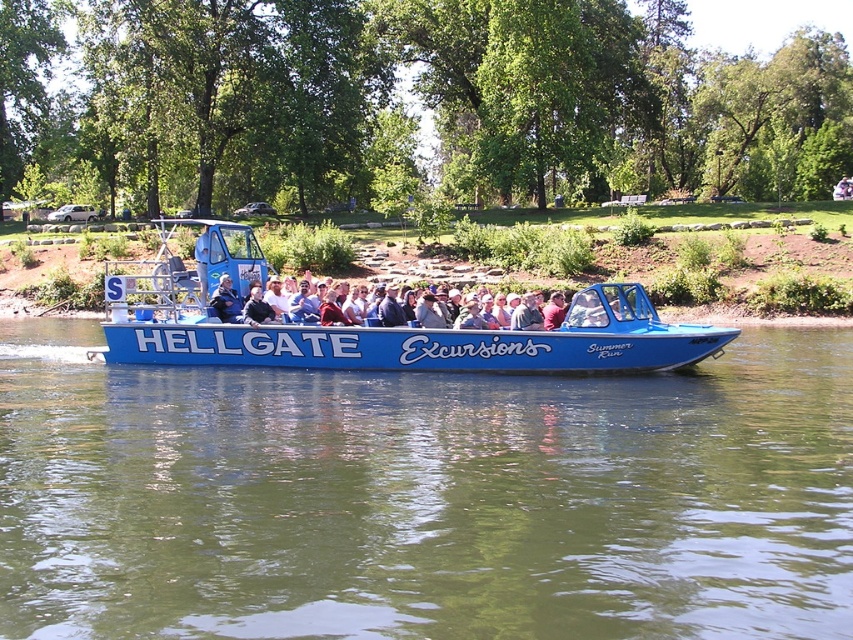
You are a photographer planning to capture the green smooth water at center and the blue plastic boat at center in a single frame. Based on their widths, which object should you position closer to the edge of the frame to ensure both are fully visible?

Since the green smooth water at center has a lesser width compared to the blue plastic boat at center, you should position the green smooth water at center closer to the edge of the frame to ensure both objects are fully visible in the photograph.

You are standing on the deck of the Hellgate Excursions boat and want to take a photo of the green smooth water at center. Where should you aim your camera to capture it?

The green smooth water at center is located at the 2D coordinates point (424, 497), so aim your camera towards that point to capture it.

You are standing on the deck of the Hellgate Excursions boat and notice a specific point marked at coordinates [424,497]. What is located at that point?

The point at coordinates [424,497] marks green smooth water at center.